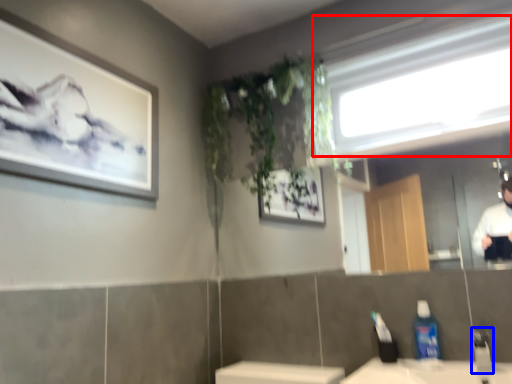
Question: Which point is closer to the camera, window (highlighted by a red box) or faucet (highlighted by a blue box)?

Choices:
 (A) window
 (B) faucet

Answer: (B)